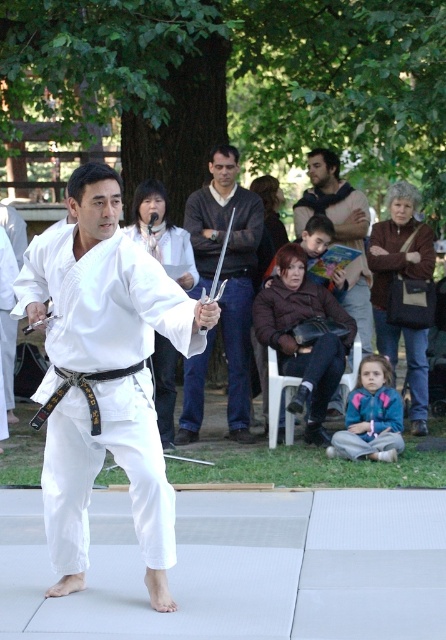
Can you confirm if white cotton kimono at center is positioned below matte black sweater at center?

Yes, white cotton kimono at center is below matte black sweater at center.

Does point (41, 262) come in front of point (246, 192)?

Yes, it is.

Describe the element at coordinates (103, 376) in the screenshot. This screenshot has height=640, width=446. I see `white cotton kimono at center` at that location.

The image size is (446, 640). Identify the location of white cotton kimono at center. (103, 376).

Is point (91, 308) farther from camera compared to point (368, 344)?

No, (91, 308) is in front of (368, 344).

Is point (54, 385) positioned before point (300, 209)?

Yes, point (54, 385) is in front of point (300, 209).

Find the location of a particular element. white cotton kimono at center is located at coordinates (103, 376).

Which is above, matte black sweater at center or brown leather jacket at center?

brown leather jacket at center

Is point (242, 403) closer to camera compared to point (297, 204)?

Yes, point (242, 403) is in front of point (297, 204).

Image resolution: width=446 pixels, height=640 pixels. I want to click on matte black sweater at center, so click(228, 269).

At what (x,y) coordinates should I click in order to perform the action: click on matte black sweater at center. Please return your answer as a coordinate pair (x, y). Image resolution: width=446 pixels, height=640 pixels. Looking at the image, I should click on (228, 269).